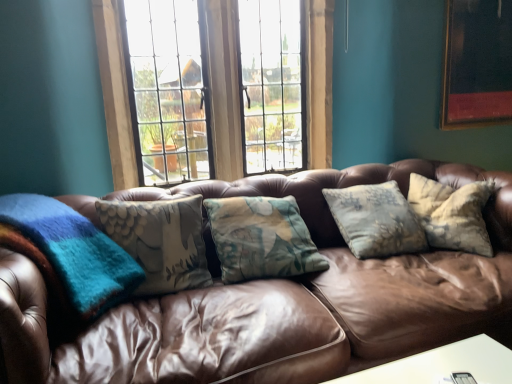
Describe the element at coordinates (224, 89) in the screenshot. I see `wooden frame window at center` at that location.

Find the location of a particular element. wooden frame window at center is located at coordinates (224, 89).

What is the approximate height of wooden picture frame at upper right?

The height of wooden picture frame at upper right is 28.85 inches.

The width and height of the screenshot is (512, 384). What do you see at coordinates (477, 64) in the screenshot?
I see `wooden picture frame at upper right` at bounding box center [477, 64].

Find the location of `wooden frame window at center`. wooden frame window at center is located at coordinates (224, 89).

Who is taller, brown leather couch at center or wooden frame window at center?

Standing taller between the two is wooden frame window at center.

Is brown leather couch at center in contact with wooden frame window at center?

No, brown leather couch at center is not in contact with wooden frame window at center.

Which of these two, brown leather couch at center or wooden frame window at center, is wider?

brown leather couch at center is wider.

Is wooden frame window at center directly adjacent to brown leather couch at center?

wooden frame window at center and brown leather couch at center are clearly separated.

Does wooden frame window at center have a lesser width compared to brown leather couch at center?

Yes, wooden frame window at center is thinner than brown leather couch at center.

Is wooden frame window at center to the right of brown leather couch at center from the viewer's perspective?

No, wooden frame window at center is not to the right of brown leather couch at center.

Is wooden picture frame at upper right positioned with its back to brown leather couch at center?

No.

Considering the relative sizes of wooden picture frame at upper right and brown leather couch at center in the image provided, is wooden picture frame at upper right taller than brown leather couch at center?

In fact, wooden picture frame at upper right may be shorter than brown leather couch at center.

Is wooden picture frame at upper right far from brown leather couch at center?

Indeed, wooden picture frame at upper right is not near brown leather couch at center.

Between wooden picture frame at upper right and brown leather couch at center, which one has larger width?

brown leather couch at center is wider.

Which object is more forward, brown leather couch at center or wooden picture frame at upper right?

brown leather couch at center is closer to the camera.

From a real-world perspective, does brown leather couch at center stand above wooden picture frame at upper right?

Actually, brown leather couch at center is physically below wooden picture frame at upper right in the real world.

Where is `studio couch directly beneath the wooden picture frame at upper right (from a real-world perspective)`? The image size is (512, 384). studio couch directly beneath the wooden picture frame at upper right (from a real-world perspective) is located at coordinates (274, 300).

Between brown leather couch at center and wooden picture frame at upper right, which one has larger size?

With larger size is brown leather couch at center.

Can you confirm if wooden picture frame at upper right is thinner than wooden frame window at center?

Yes, wooden picture frame at upper right is thinner than wooden frame window at center.

Does point (473, 37) come in front of point (312, 109)?

Yes, point (473, 37) is in front of point (312, 109).

The image size is (512, 384). I want to click on picture frame located above the wooden frame window at center (from a real-world perspective), so click(x=477, y=64).

Which of these two, wooden frame window at center or wooden picture frame at upper right, is thinner?

Thinner between the two is wooden picture frame at upper right.

Between wooden frame window at center and wooden picture frame at upper right, which one is positioned in front?

Positioned in front is wooden frame window at center.

Between wooden frame window at center and wooden picture frame at upper right, which one has less height?

wooden picture frame at upper right is shorter.

Is wooden frame window at center facing away from wooden picture frame at upper right?

That's not correct — wooden frame window at center is not looking away from wooden picture frame at upper right.

Locate an element on the screen. This screenshot has width=512, height=384. window above the brown leather couch at center (from a real-world perspective) is located at coordinates (224, 89).

Identify the location of studio couch lying on the right of wooden frame window at center. (274, 300).

When comparing their distances from brown leather couch at center, does wooden frame window at center or wooden picture frame at upper right seem further?

Among the two, wooden picture frame at upper right is located further to brown leather couch at center.

Based on their spatial positions, is brown leather couch at center or wooden frame window at center closer to wooden picture frame at upper right?

brown leather couch at center is closer to wooden picture frame at upper right.

Based on their spatial positions, is wooden picture frame at upper right or brown leather couch at center closer to wooden frame window at center?

Among the two, brown leather couch at center is located nearer to wooden frame window at center.

Estimate the real-world distances between objects in this image. Which object is further from wooden frame window at center, brown leather couch at center or wooden picture frame at upper right?

wooden picture frame at upper right lies further to wooden frame window at center than the other object.

Considering their positions, is wooden picture frame at upper right positioned closer to brown leather couch at center than wooden frame window at center?

Based on the image, wooden frame window at center appears to be nearer to brown leather couch at center.

Which object lies further to the anchor point wooden picture frame at upper right, wooden frame window at center or brown leather couch at center?

Among the two, wooden frame window at center is located further to wooden picture frame at upper right.

Identify the location of studio couch between wooden frame window at center and wooden picture frame at upper right. The width and height of the screenshot is (512, 384). (274, 300).